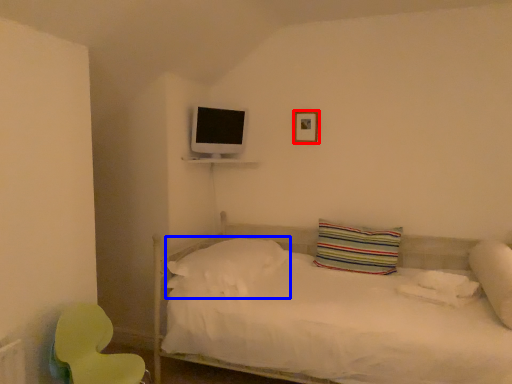
Question: Which object appears farthest to the camera in this image, picture frame (highlighted by a red box) or pillow (highlighted by a blue box)?

Choices:
 (A) picture frame
 (B) pillow

Answer: (A)